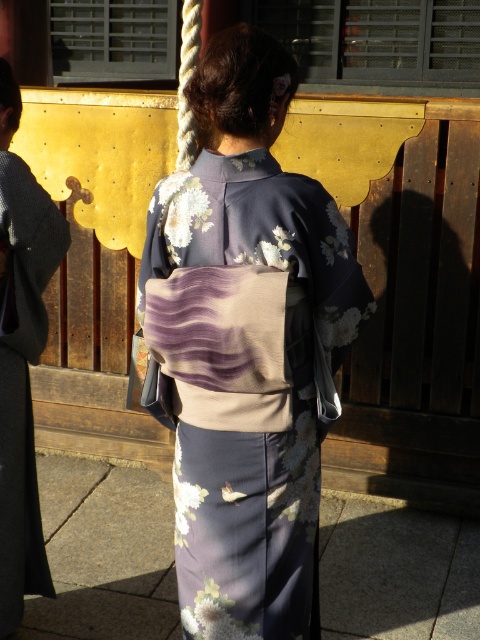
Question: Which point appears farthest from the camera in this image?

Choices:
 (A) (316, 378)
 (B) (13, 80)

Answer: (B)

Question: Does floral kimono at center have a lesser width compared to silky black kimono at center?

Choices:
 (A) yes
 (B) no

Answer: (B)

Question: Observing the image, what is the correct spatial positioning of floral kimono at center in reference to silky black kimono at center?

Choices:
 (A) left
 (B) right

Answer: (B)

Question: In this image, where is floral kimono at center located relative to silky black kimono at center?

Choices:
 (A) left
 (B) right

Answer: (B)

Question: Which point is farther to the camera?

Choices:
 (A) (6, 106)
 (B) (203, 358)

Answer: (A)

Question: Which object is farther from the camera taking this photo?

Choices:
 (A) silky black kimono at center
 (B) floral kimono at center

Answer: (A)